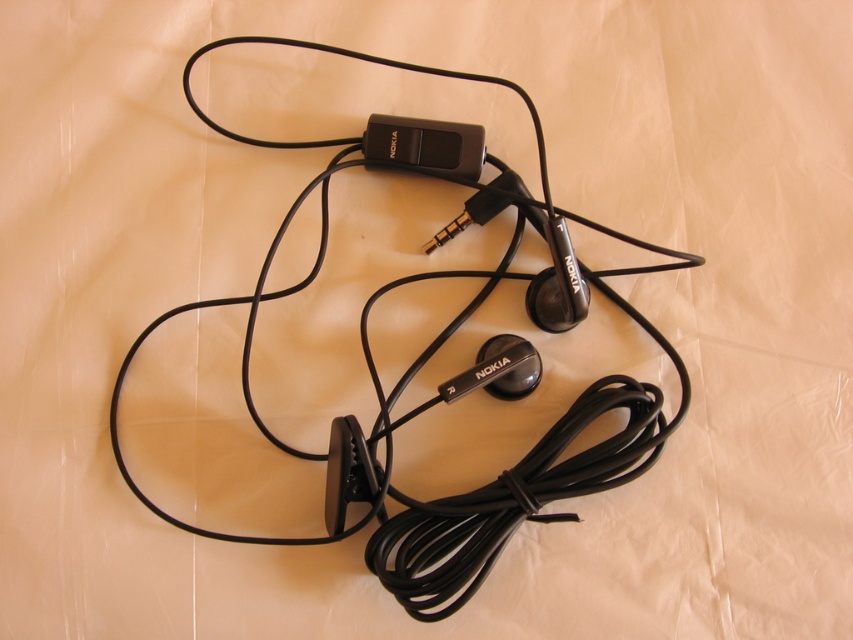
Looking at this image, you are positioning a small sticker on the fabric surface to mark the exact center point of the black rubber cable at center. What are the coordinates where you should place the sticker?

The coordinates for the exact center point of the black rubber cable at center are located at point (459, 392).

You are a photographer trying to capture the Nokia earphones from above. You notice two points on the earphones labeled as point (625, 394) and point (450, 138). Which point will appear larger in your photo?

Point (625, 394) is closer to the camera than point (450, 138), so it will appear larger in the photo.